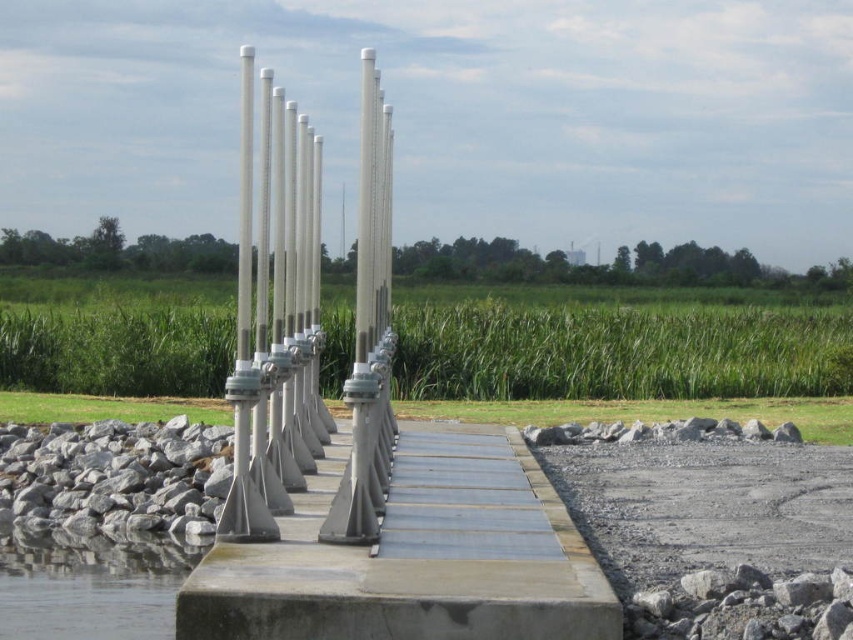
You are a delivery drone with a wingspan of 1.8 meters. You need to fly from the smooth concrete dock at center to the clear water at lower left. Is there enough space between them for your drone to pass through?

The distance between the smooth concrete dock at center and clear water at lower left is 2.03 meters. Since your drone has a wingspan of 1.8 meters, there is sufficient space for it to pass through safely.

You are a maintenance worker needing to place a 2 meter wide equipment on the dock. Can the smooth concrete dock at center accommodate the equipment given its width compared to the metallic gray boardwalk at center?

The smooth concrete dock at center is wider than the metallic gray boardwalk at center. Since the dock is wider, it can accommodate the 2 meter wide equipment.